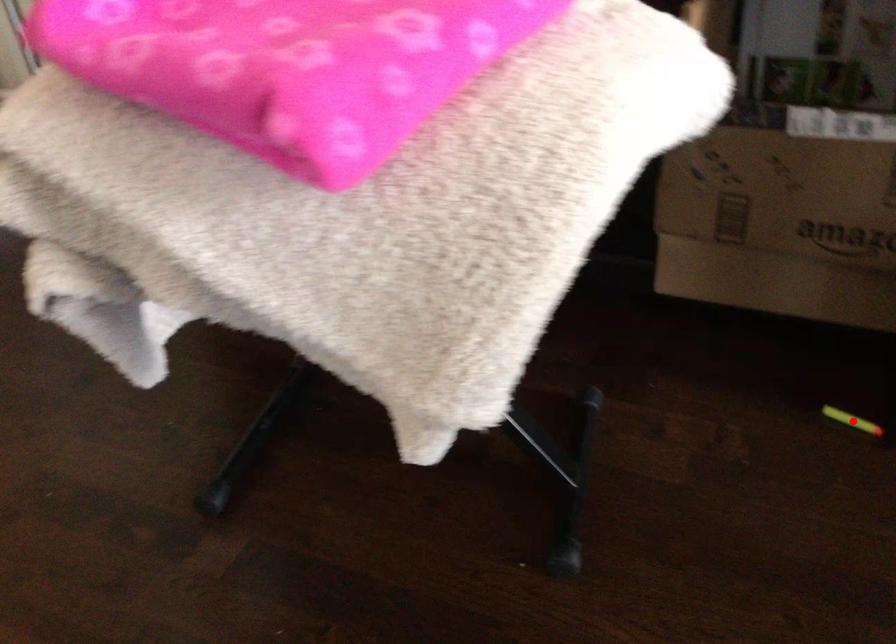
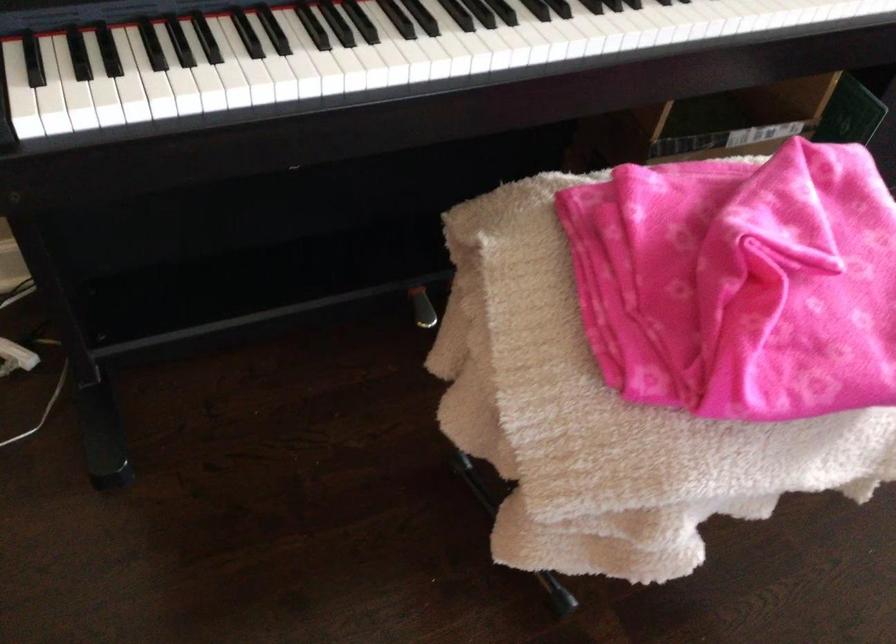
Question: I am providing you with two images of the same scene from different viewpoints. A red point is marked on the first image. Is the red point's position out of view in image 2?

Choices:
 (A) Yes
 (B) No

Answer: (A)